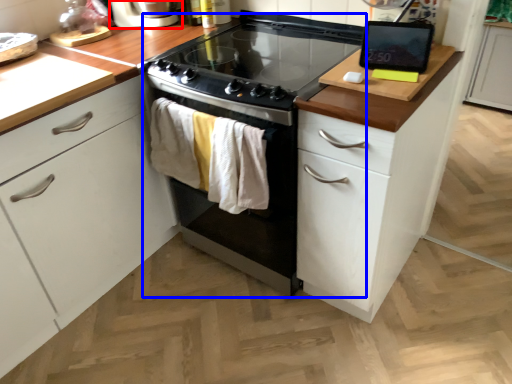
Question: Which object is closer to the camera taking this photo, home appliance (highlighted by a red box) or oven (highlighted by a blue box)?

Choices:
 (A) home appliance
 (B) oven

Answer: (B)